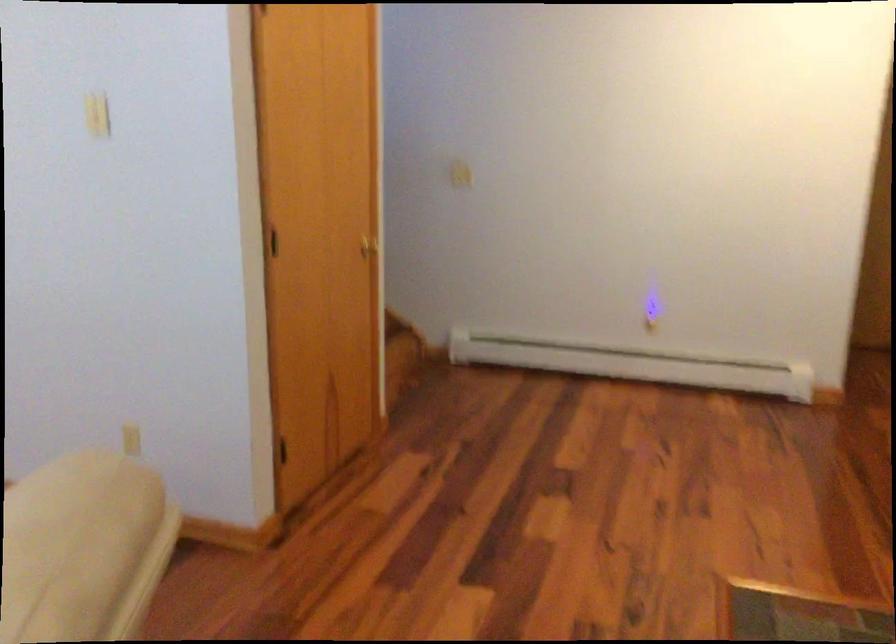
The image size is (896, 644). What do you see at coordinates (331, 424) in the screenshot? I see `the recessed door handle` at bounding box center [331, 424].